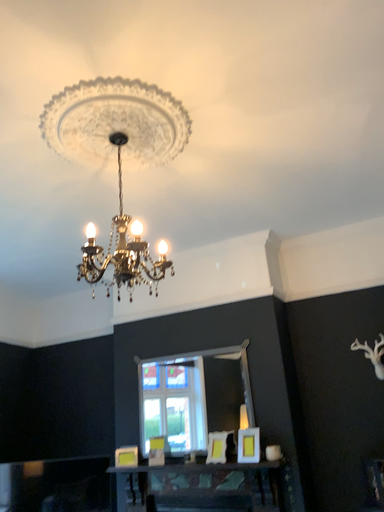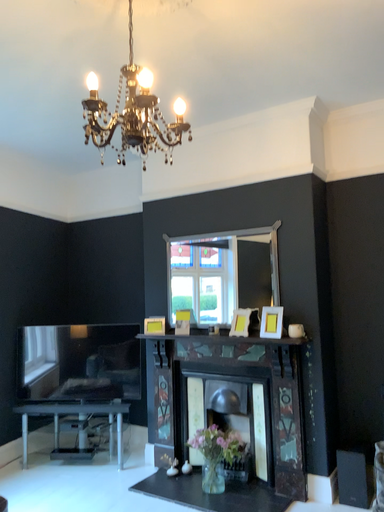
Question: How did the camera likely rotate when shooting the video?

Choices:
 (A) rotated downward
 (B) rotated upward

Answer: (A)